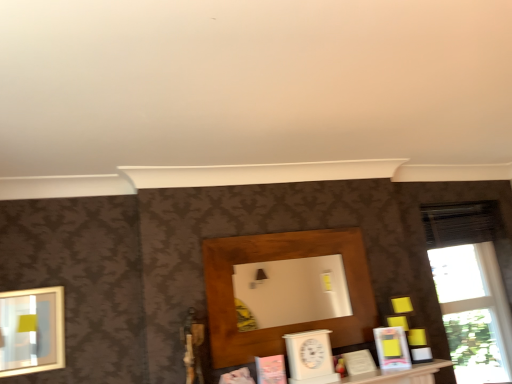
Question: Is matte pink book at center, the fourth book positioned from the right, to the left of transparent glass window at right from the viewer's perspective?

Choices:
 (A) yes
 (B) no

Answer: (A)

Question: Does matte pink book at center, acting as the 1th book starting from the left, have a greater width compared to transparent glass window at right?

Choices:
 (A) no
 (B) yes

Answer: (A)

Question: Is matte pink book at center, acting as the 1th book starting from the left, surrounding transparent glass window at right?

Choices:
 (A) no
 (B) yes

Answer: (A)

Question: Is the surface of matte pink book at center, the fourth book positioned from the right, in direct contact with transparent glass window at right?

Choices:
 (A) yes
 (B) no

Answer: (B)

Question: Is matte pink book at center, the fourth book positioned from the right, aimed at transparent glass window at right?

Choices:
 (A) yes
 (B) no

Answer: (B)

Question: Is white matte book at center, which appears as the 3th book when viewed from the left, aimed at matte gold picture frame at left?

Choices:
 (A) no
 (B) yes

Answer: (A)

Question: Considering the relative sizes of white matte book at center, the second book in the right-to-left sequence, and matte gold picture frame at left in the image provided, is white matte book at center, the second book in the right-to-left sequence, shorter than matte gold picture frame at left?

Choices:
 (A) yes
 (B) no

Answer: (A)

Question: Would you say white matte book at center, which appears as the 3th book when viewed from the left, contains matte gold picture frame at left?

Choices:
 (A) no
 (B) yes

Answer: (A)

Question: Is matte gold picture frame at left at the back of white matte book at center, the second book in the right-to-left sequence?

Choices:
 (A) yes
 (B) no

Answer: (B)

Question: Does white matte book at center, the second book in the right-to-left sequence, lie in front of matte gold picture frame at left?

Choices:
 (A) no
 (B) yes

Answer: (A)

Question: Is the depth of white matte book at center, which appears as the 3th book when viewed from the left, greater than that of matte gold picture frame at left?

Choices:
 (A) no
 (B) yes

Answer: (B)

Question: From a real-world perspective, is wooden shelf at center on matte pink book at center, acting as the 1th book starting from the left?

Choices:
 (A) yes
 (B) no

Answer: (A)